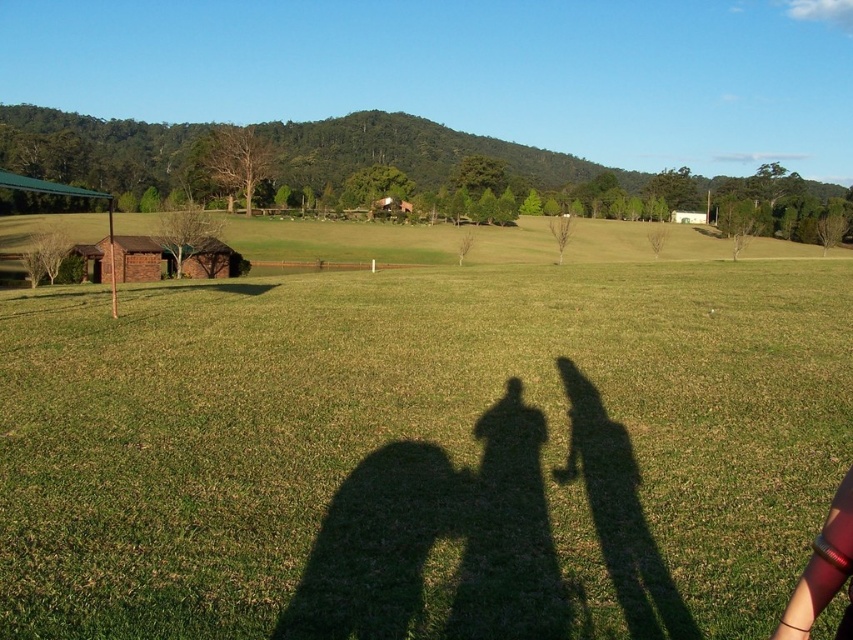
Question: Which point appears farthest from the camera in this image?

Choices:
 (A) [x=16, y=564]
 (B) [x=813, y=579]

Answer: (A)

Question: Is green grass at center closer to camera compared to red fabric arm at lower right?

Choices:
 (A) no
 (B) yes

Answer: (A)

Question: Where is green grass at center located in relation to red fabric arm at lower right in the image?

Choices:
 (A) above
 (B) below

Answer: (A)

Question: Is green grass at center positioned before red fabric arm at lower right?

Choices:
 (A) no
 (B) yes

Answer: (A)